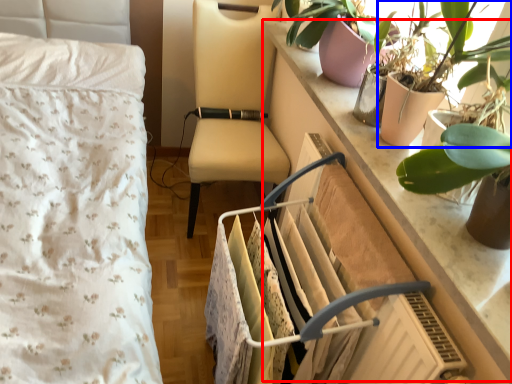
Question: Which point is further to the camera, counter top (highlighted by a red box) or houseplant (highlighted by a blue box)?

Choices:
 (A) counter top
 (B) houseplant

Answer: (B)